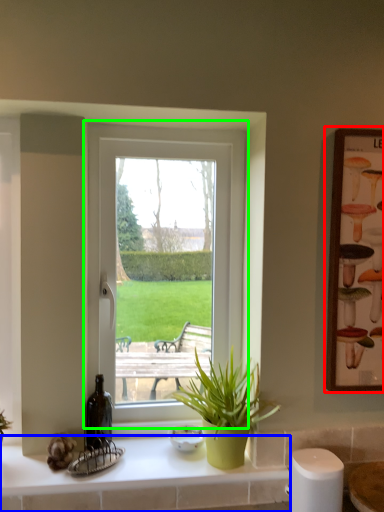
Question: Which object is positioned closest to picture frame (highlighted by a red box)? Select from counter top (highlighted by a blue box) and window (highlighted by a green box).

Choices:
 (A) counter top
 (B) window

Answer: (B)